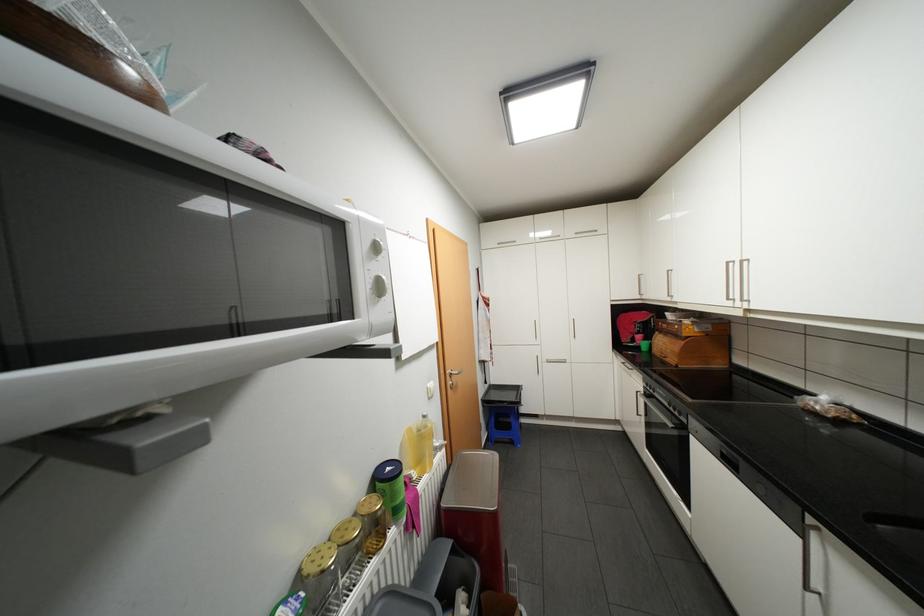
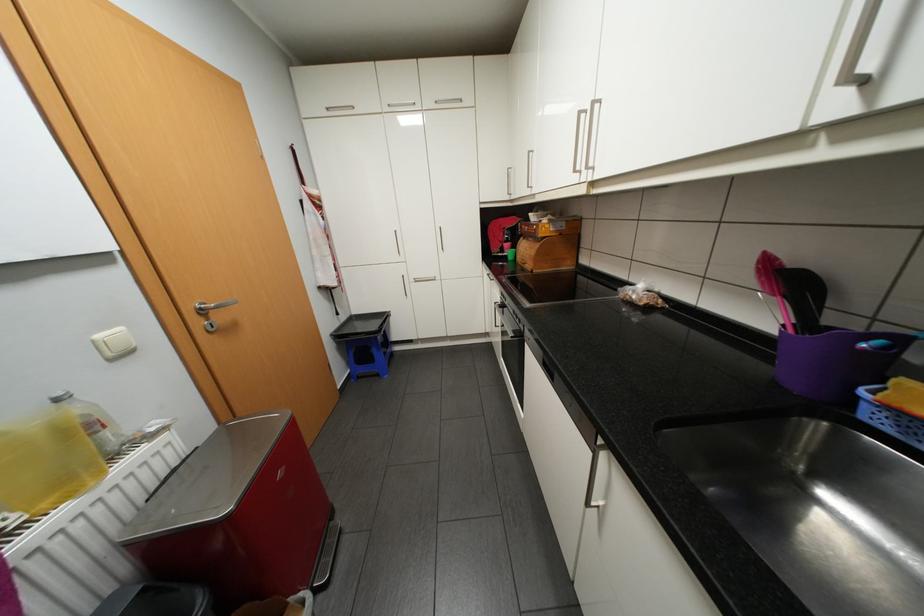
Locate, in the second image, the point that corresponds to (x=650, y=418) in the first image.

(506, 329)